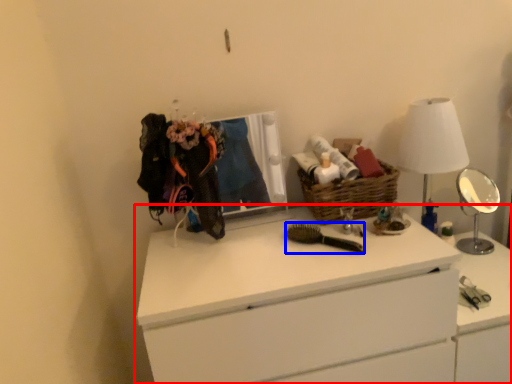
Question: Which object appears closest to the camera in this image, chest of drawers (highlighted by a red box) or brush (highlighted by a blue box)?

Choices:
 (A) chest of drawers
 (B) brush

Answer: (A)